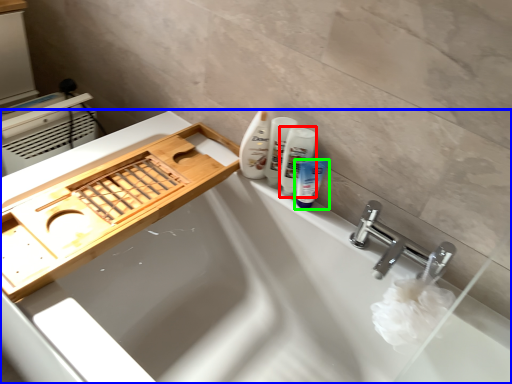
Question: Based on their relative distances, which object is farther from mouthwash (highlighted by a red box)? Choose from bathtub (highlighted by a blue box) and toiletry (highlighted by a green box).

Choices:
 (A) bathtub
 (B) toiletry

Answer: (A)